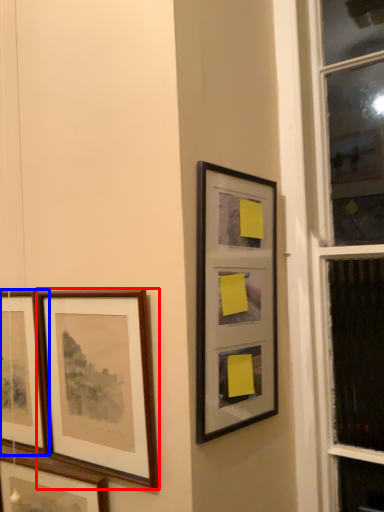
Question: Which object is closer to the camera taking this photo, picture frame (highlighted by a red box) or picture frame (highlighted by a blue box)?

Choices:
 (A) picture frame
 (B) picture frame

Answer: (A)